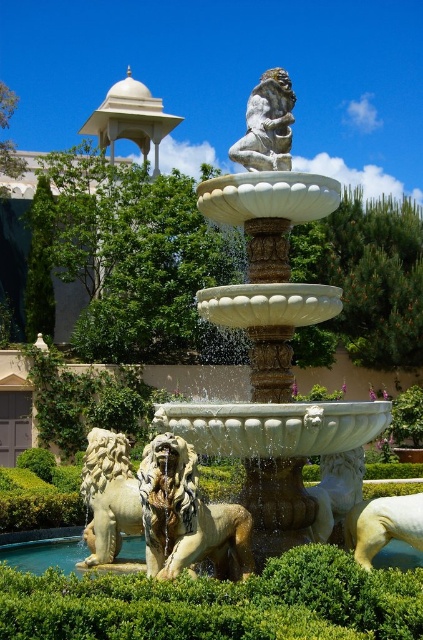
You are a maintenance worker needing to reach both the white stone lion at left and the gray stone monkey at upper center for cleaning. If your ladder can extend up to 12 meters, will you be able to clean both objects without moving the ladder?

The distance between the white stone lion at left and the gray stone monkey at upper center is 13.37 meters. Since your ladder can only extend up to 12 meters, you will not be able to reach both objects without moving the ladder.

In the scene shown: You are planning to place a new bench in the garden. The gazebo and the lion are both near the fountain. Which object has a greater width, the beige marble gazebo at upper left or the white marble lion at lower right?

The beige marble gazebo at upper left has a greater width than the white marble lion at lower right according to the description.